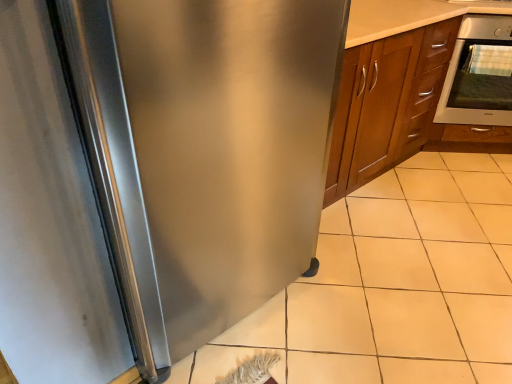
At what (x,y) coordinates should I click in order to perform the action: click on vacant area that lies to the right of stainless steel refrigerator at left. Please return your answer as a coordinate pair (x, y). Looking at the image, I should click on (374, 319).